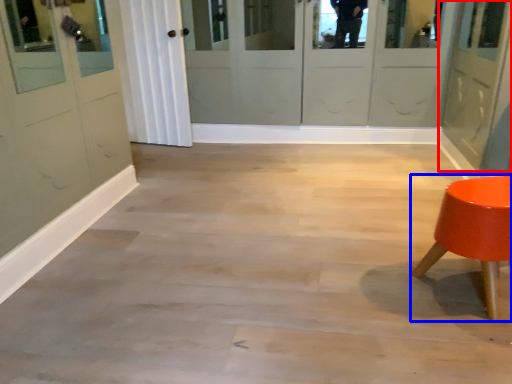
Question: Which of the following is the closest to the observer, door (highlighted by a red box) or furniture (highlighted by a blue box)?

Choices:
 (A) door
 (B) furniture

Answer: (B)